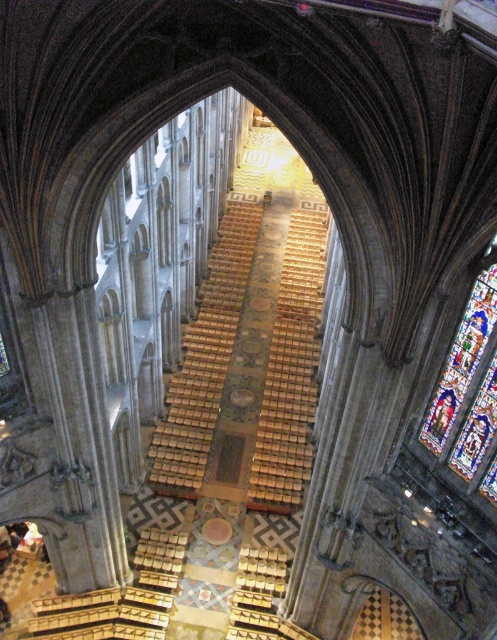
Question: Is wooden at center wider than stained glass at right?

Choices:
 (A) yes
 (B) no

Answer: (A)

Question: Can you confirm if wooden at center is smaller than stained glass at right?

Choices:
 (A) yes
 (B) no

Answer: (B)

Question: Which point is closer to the camera taking this photo?

Choices:
 (A) (463, 362)
 (B) (257, 509)
 (C) (153, 449)

Answer: (A)

Question: Where is wooden pews at center located in relation to stained glass at right in the image?

Choices:
 (A) above
 (B) below

Answer: (A)

Question: Which point is closer to the camera?

Choices:
 (A) (496, 234)
 (B) (286, 276)
 (C) (172, 458)

Answer: (A)

Question: Which point is closer to the camera?

Choices:
 (A) click(257, 208)
 (B) click(268, 394)

Answer: (B)